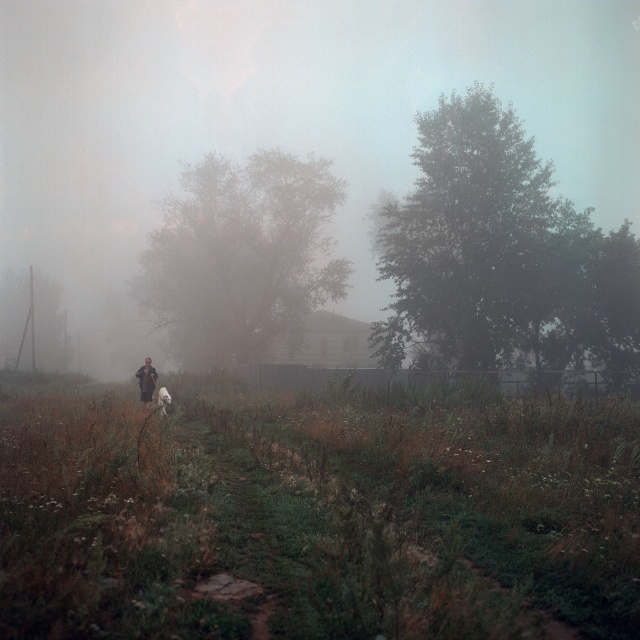
You are standing at the dirt path in the rural scene and see two points marked in the image. Which point is closer to you, point (109, 305) or point (170, 396)?

Point (109, 305) is closer to you because it is further to the viewer than point (170, 396).

You are a photographer trying to capture the white fluffy dog at center in the image. Considering the presence of the foggy translucent morning fog at center, will the dog be clearly visible in your photo?

The foggy translucent morning fog at center might be wider than the white fluffy dog at center, so the dog may not be clearly visible due to the fog obscuring it.